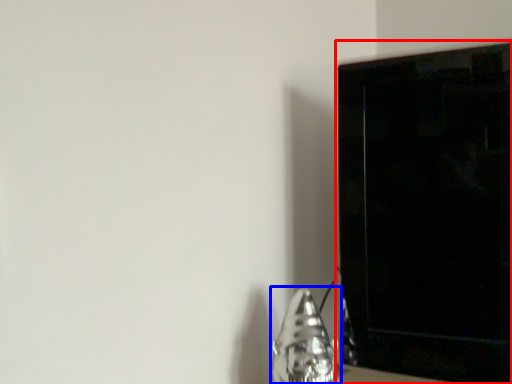
Question: Which object is closer to the camera taking this photo, furniture (highlighted by a red box) or silver (highlighted by a blue box)?

Choices:
 (A) furniture
 (B) silver

Answer: (B)